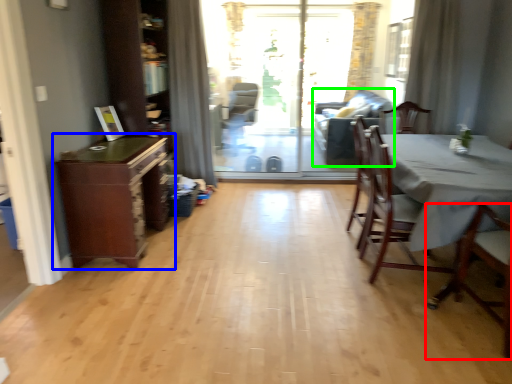
Question: Estimate the real-world distances between objects in this image. Which object is farther from chair (highlighted by a red box), cabinetry (highlighted by a blue box) or couch (highlighted by a green box)?

Choices:
 (A) cabinetry
 (B) couch

Answer: (B)